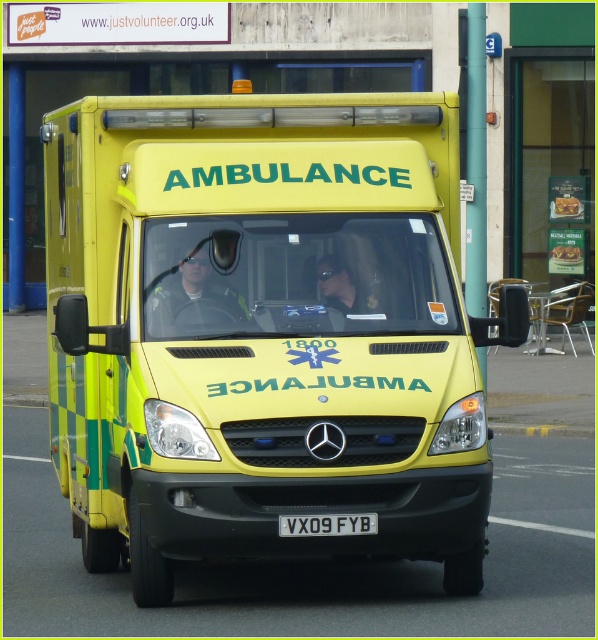
Is yellow matte ambulance at center further to the viewer compared to white plastic license plate at center?

No, yellow matte ambulance at center is closer to the viewer.

Is point (454, 563) more distant than point (367, 524)?

That is True.

Identify the location of yellow matte ambulance at center. (266, 332).

Is reflective safety vest at center to the left of matte black uniform at center from the viewer's perspective?

Indeed, reflective safety vest at center is positioned on the left side of matte black uniform at center.

Who is shorter, reflective safety vest at center or matte black uniform at center?

With less height is matte black uniform at center.

Image resolution: width=598 pixels, height=640 pixels. Find the location of `reflective safety vest at center`. reflective safety vest at center is located at coordinates (196, 292).

This screenshot has height=640, width=598. Describe the element at coordinates (343, 289) in the screenshot. I see `matte black uniform at center` at that location.

Is point (331, 253) behind point (325, 520)?

Yes, it is.

Image resolution: width=598 pixels, height=640 pixels. I want to click on matte black uniform at center, so click(x=343, y=289).